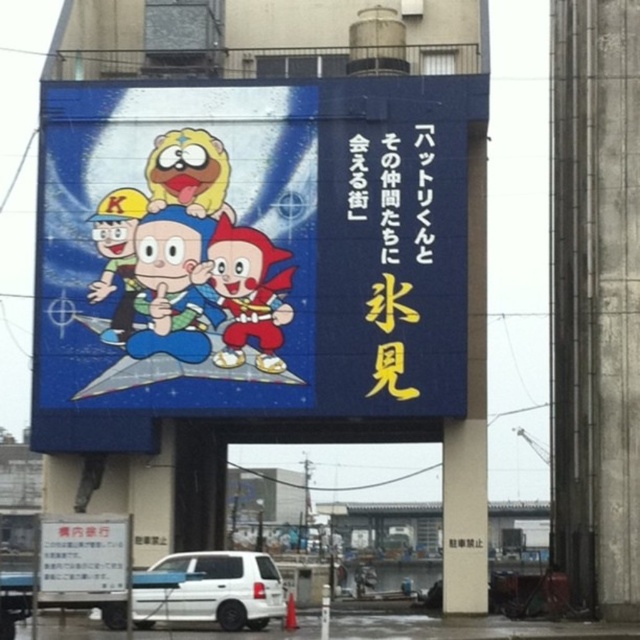
Question: Does cartoon characters at center have a smaller size compared to white matte van at lower center?

Choices:
 (A) yes
 (B) no

Answer: (B)

Question: Which of the following is the farthest from the observer?

Choices:
 (A) matte blue suit at center
 (B) white matte van at lower center
 (C) shiny red helmet at center

Answer: (A)

Question: Estimate the real-world distances between objects in this image. Which object is farther from the white matte van at lower center?

Choices:
 (A) matte blue suit at center
 (B) cartoon characters at center
 (C) shiny red helmet at center

Answer: (B)

Question: In this image, where is cartoon characters at center located relative to white matte van at lower center?

Choices:
 (A) left
 (B) right

Answer: (B)

Question: Which object is positioned closest to the cartoon characters at center?

Choices:
 (A) matte blue suit at center
 (B) shiny red helmet at center
 (C) white matte van at lower center

Answer: (A)

Question: Is cartoon characters at center smaller than white matte van at lower center?

Choices:
 (A) yes
 (B) no

Answer: (B)